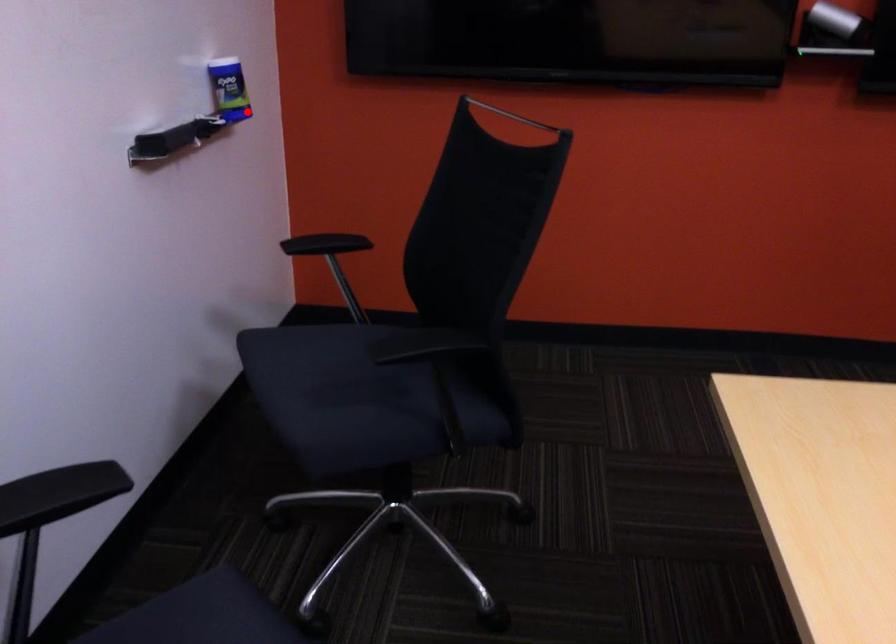
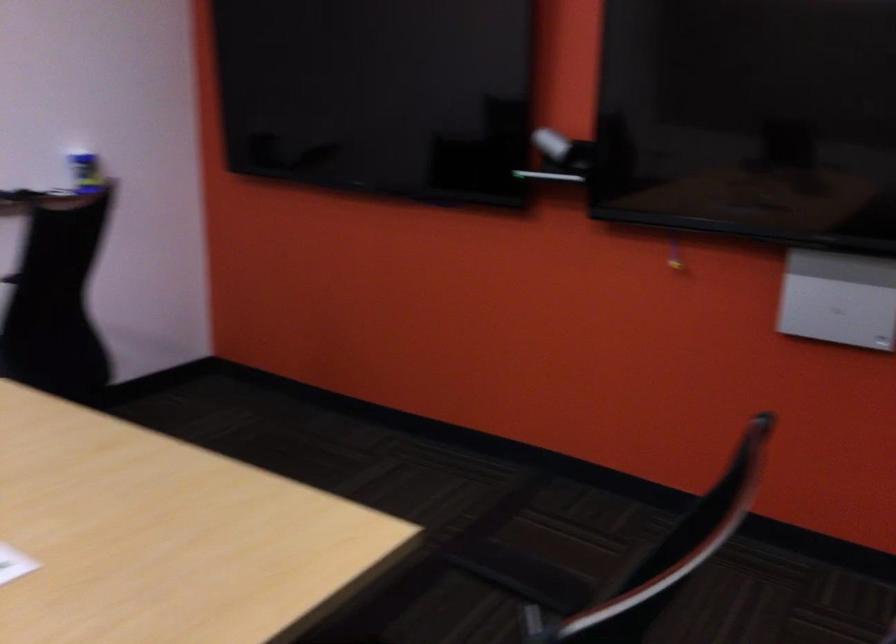
The point at the highlighted location is marked in the first image. Where is the corresponding point in the second image?

(85, 172)